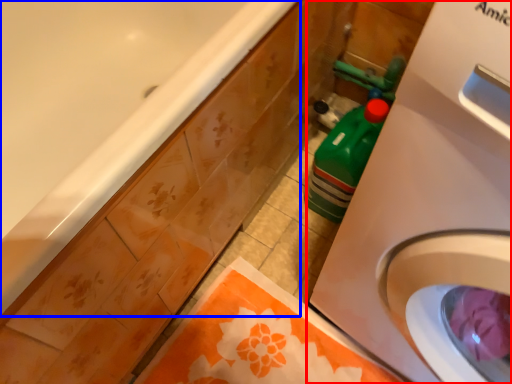
Question: Among these objects, which one is nearest to the camera, washing machine (highlighted by a red box) or bathtub (highlighted by a blue box)?

Choices:
 (A) washing machine
 (B) bathtub

Answer: (A)